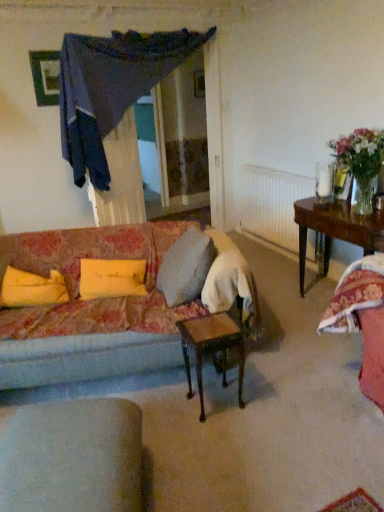
This screenshot has height=512, width=384. In order to click on free point above light gray fabric chair at lower left (from a real-world perspective) in this screenshot , I will do `click(66, 444)`.